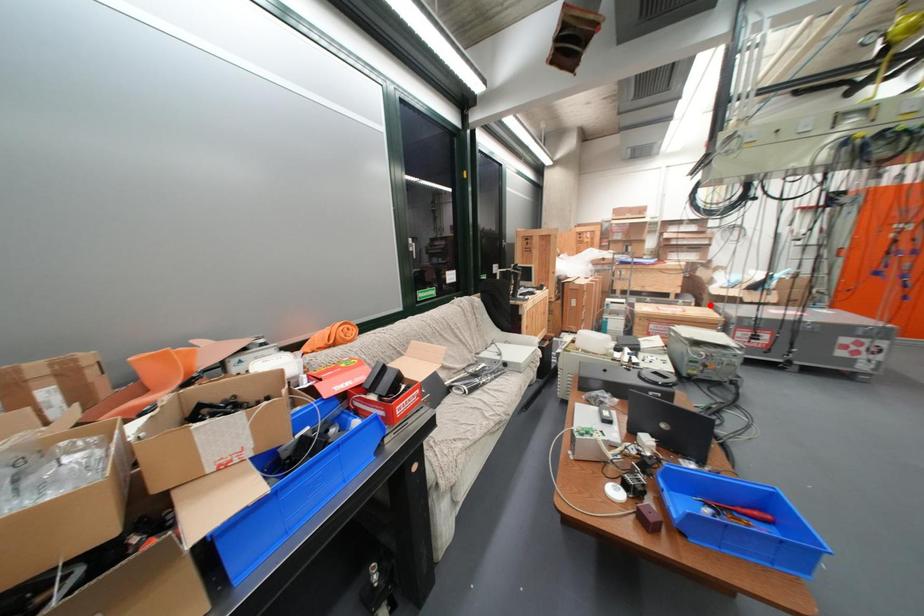
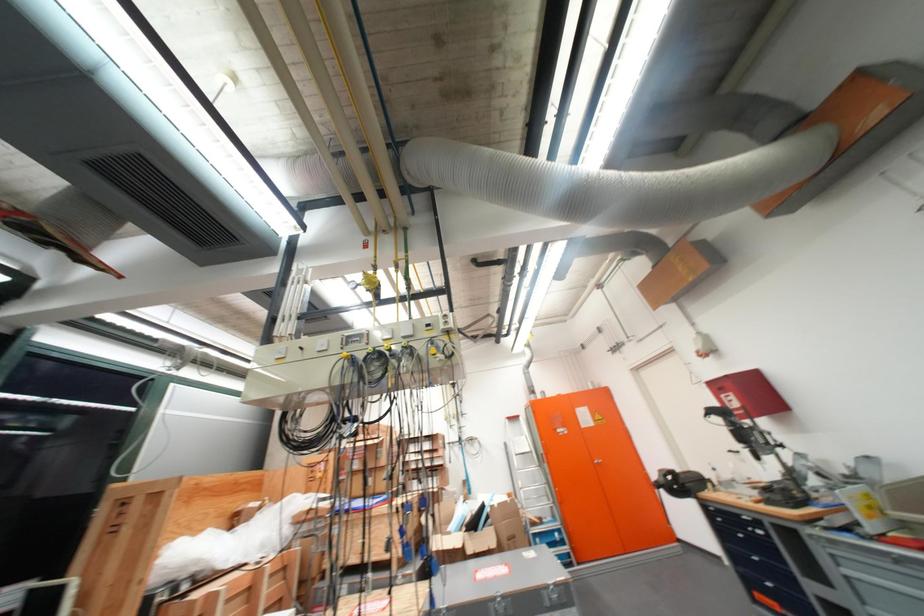
Question: I am providing you with two images of the same scene from different viewpoints. In image1, a red point is highlighted. Considering the same 3D point in image2, which of the following is correct?

Choices:
 (A) It is closer
 (B) It is farther

Answer: (B)